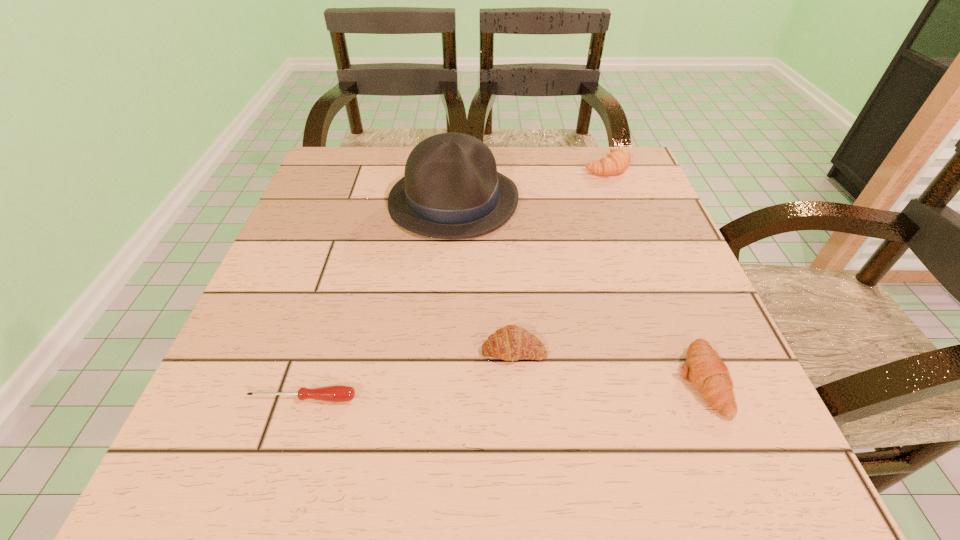
This screenshot has height=540, width=960. In order to click on crescent roll present at the far edge in this screenshot , I will do `click(617, 161)`.

Where is `object at the left edge`? object at the left edge is located at coordinates click(x=337, y=393).

The image size is (960, 540). In order to click on object at the far right corner in this screenshot , I will do `click(617, 161)`.

This screenshot has height=540, width=960. What are the coordinates of `vacant position at the far edge of the desktop` in the screenshot? It's located at (537, 158).

At what (x,y) coordinates should I click in order to perform the action: click on vacant area at the left edge. Please return your answer as a coordinate pair (x, y). This screenshot has height=540, width=960. Looking at the image, I should click on (345, 238).

This screenshot has height=540, width=960. I want to click on free space at the right edge of the desktop, so click(x=667, y=394).

Where is `free space at the far left corner`? The width and height of the screenshot is (960, 540). free space at the far left corner is located at coordinates (367, 198).

The height and width of the screenshot is (540, 960). What are the coordinates of `vacant region at the near left corner` in the screenshot? It's located at (169, 497).

This screenshot has width=960, height=540. In the image, there is a desktop. In order to click on vacant space at the far right corner in this screenshot , I will do `click(589, 192)`.

Identify the location of vacant area between the screwdriver and the leftmost crescent roll. (408, 374).